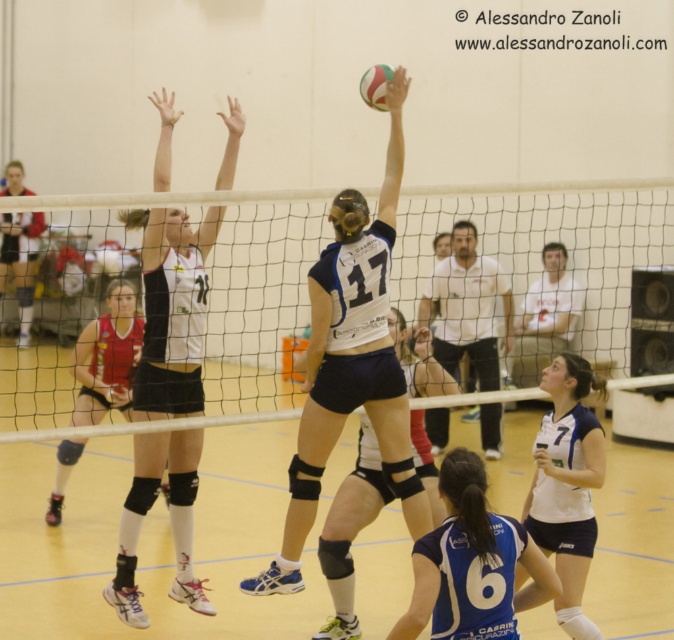
Question: Which object appears farthest from the camera in this image?

Choices:
 (A) white mesh net at center
 (B) white matte volleyball at center

Answer: (B)

Question: Does white matte volleyball at center lie in front of white matte volleyball net at upper center?

Choices:
 (A) yes
 (B) no

Answer: (A)

Question: Can you confirm if white matte volleyball net at upper center is thinner than matte black shorts at upper left?

Choices:
 (A) yes
 (B) no

Answer: (A)

Question: Estimate the real-world distances between objects in this image. Which object is farther from the white matte volleyball net at upper center?

Choices:
 (A) dark blue synthetic shorts at center
 (B) blue matte jersey at center
 (C) red jersey at center

Answer: (B)

Question: Which point appears farthest from the camera in this image?

Choices:
 (A) [406, 356]
 (B) [154, 461]
 (C) [353, 326]
 (D) [121, 278]

Answer: (D)

Question: Is white matte jersey at center closer to the viewer compared to matte black shorts at upper left?

Choices:
 (A) no
 (B) yes

Answer: (B)